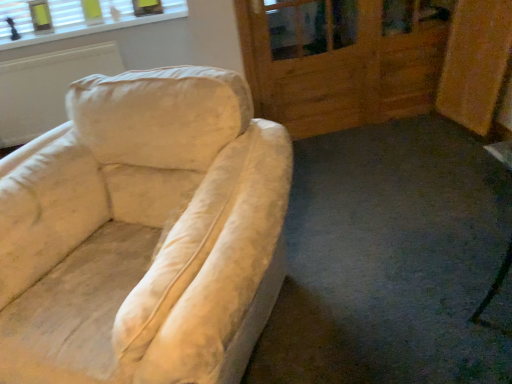
The image size is (512, 384). What do you see at coordinates (341, 60) in the screenshot?
I see `wooden screen door at upper right` at bounding box center [341, 60].

Measure the distance between point (352,8) and camera.

The distance of point (352,8) from camera is 8.54 feet.

At what (x,y) coordinates should I click in order to perform the action: click on wooden screen door at upper right. Please return your answer as a coordinate pair (x, y). The width and height of the screenshot is (512, 384). Looking at the image, I should click on click(x=341, y=60).

The width and height of the screenshot is (512, 384). Describe the element at coordinates (76, 19) in the screenshot. I see `white textured blinds at upper left` at that location.

Where is `white textured blinds at upper left`? white textured blinds at upper left is located at coordinates (76, 19).

In order to face white textured blinds at upper left, should I rotate leftwards or rightwards?

Turn left approximately 21.978 degrees to face it.

I want to click on wooden screen door at upper right, so click(341, 60).

Can you confirm if wooden screen door at upper right is positioned to the left of white textured blinds at upper left?

Incorrect, wooden screen door at upper right is not on the left side of white textured blinds at upper left.

Looking at this image, is wooden screen door at upper right in front of or behind white textured blinds at upper left in the image?

wooden screen door at upper right is positioned closer to the viewer than white textured blinds at upper left.

Considering the points (284, 83) and (52, 31), which point is in front, point (284, 83) or point (52, 31)?

The point (284, 83) is closer.

From the image's perspective, is wooden screen door at upper right located beneath white textured blinds at upper left?

Yes, from the image's perspective, wooden screen door at upper right is below white textured blinds at upper left.

From a real-world perspective, is wooden screen door at upper right physically located above or below white textured blinds at upper left?

In terms of real-world spatial position, wooden screen door at upper right is below white textured blinds at upper left.

Based on the photo, looking at their sizes, would you say wooden screen door at upper right is wider or thinner than white textured blinds at upper left?

wooden screen door at upper right is wider than white textured blinds at upper left.

Between wooden screen door at upper right and white textured blinds at upper left, which one has less height?

white textured blinds at upper left.

Who is bigger, wooden screen door at upper right or white textured blinds at upper left?

Bigger between the two is wooden screen door at upper right.

Which is correct: wooden screen door at upper right is inside white textured blinds at upper left, or outside of it?

wooden screen door at upper right is spatially situated outside white textured blinds at upper left.

Are wooden screen door at upper right and white textured blinds at upper left located far from each other?

Yes, wooden screen door at upper right is far from white textured blinds at upper left.

Is white textured blinds at upper left at the back of wooden screen door at upper right?

No, wooden screen door at upper right is not facing away from white textured blinds at upper left.

How many degrees apart are the facing directions of wooden screen door at upper right and white textured blinds at upper left?

They differ by 1.76 degrees in their facing directions.

In order to click on screen door below the white textured blinds at upper left (from the image's perspective) in this screenshot , I will do `click(341, 60)`.

Is white textured blinds at upper left at the right side of wooden screen door at upper right?

In fact, white textured blinds at upper left is to the left of wooden screen door at upper right.

Which object is closer to the camera, white textured blinds at upper left or wooden screen door at upper right?

Positioned in front is wooden screen door at upper right.

Which point is more distant from viewer, (x=83, y=30) or (x=260, y=63)?

The point (x=83, y=30) is behind.

From the image's perspective, which one is positioned higher, white textured blinds at upper left or wooden screen door at upper right?

white textured blinds at upper left appears higher in the image.

From a real-world perspective, is white textured blinds at upper left positioned over wooden screen door at upper right based on gravity?

Yes, from a real-world perspective, white textured blinds at upper left is on top of wooden screen door at upper right.

Which of these two, white textured blinds at upper left or wooden screen door at upper right, is wider?

Wider between the two is wooden screen door at upper right.

Who is taller, white textured blinds at upper left or wooden screen door at upper right?

wooden screen door at upper right is taller.

Is white textured blinds at upper left smaller than wooden screen door at upper right?

Yes.

Choose the correct answer: Is white textured blinds at upper left inside wooden screen door at upper right or outside it?

white textured blinds at upper left is outside wooden screen door at upper right.

Is white textured blinds at upper left next to wooden screen door at upper right and touching it?

No.

Does white textured blinds at upper left turn towards wooden screen door at upper right?

No, white textured blinds at upper left does not turn towards wooden screen door at upper right.

Can you tell me how much white textured blinds at upper left and wooden screen door at upper right differ in facing direction?

They differ by 1.76 degrees in their facing directions.

You are a GUI agent. You are given a task and a screenshot of the screen. Output one action in this format:
    pyautogui.click(x=<x>, y=<y>)
    Task: Click on the window above the wooden screen door at upper right (from the image's perspective)
    Image resolution: width=512 pixels, height=384 pixels.
    Given the screenshot: What is the action you would take?
    pyautogui.click(x=76, y=19)

You are a GUI agent. You are given a task and a screenshot of the screen. Output one action in this format:
    pyautogui.click(x=<x>, y=<y>)
    Task: Click on the screen door that appears below the white textured blinds at upper left (from a real-world perspective)
    The height and width of the screenshot is (384, 512).
    Given the screenshot: What is the action you would take?
    pyautogui.click(x=341, y=60)

Locate an element on the screen. This screenshot has height=384, width=512. screen door on the right side of white textured blinds at upper left is located at coordinates (341, 60).